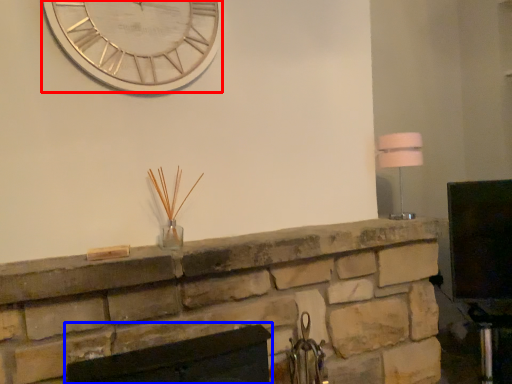
Question: Which object appears closest to the camera in this image, wall clock (highlighted by a red box) or fireplace (highlighted by a blue box)?

Choices:
 (A) wall clock
 (B) fireplace

Answer: (B)